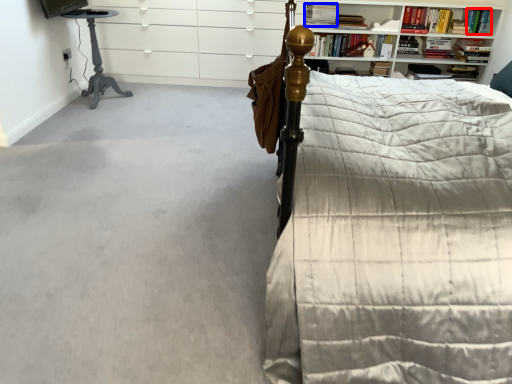
Question: Which object is closer to the camera taking this photo, book (highlighted by a red box) or book (highlighted by a blue box)?

Choices:
 (A) book
 (B) book

Answer: (B)